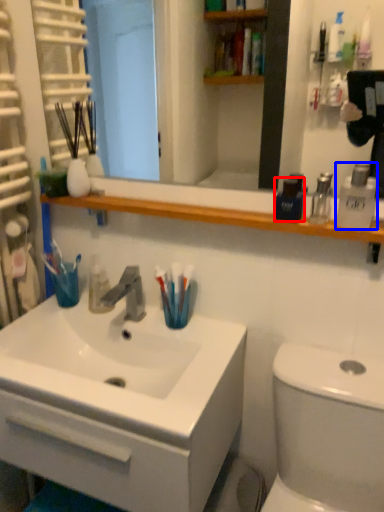
Question: Which object is further to the camera taking this photo, mouthwash (highlighted by a red box) or mouthwash (highlighted by a blue box)?

Choices:
 (A) mouthwash
 (B) mouthwash

Answer: (A)